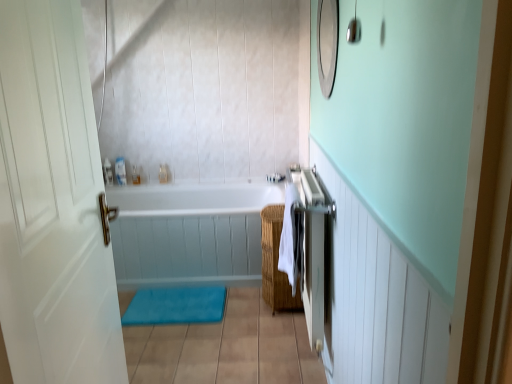
Measure the distance between point (165, 308) and camera.

A: They are 8.16 feet apart.

Where is `translucent plastic container at upper center, the first toiletry when ordered from right to left`? The width and height of the screenshot is (512, 384). translucent plastic container at upper center, the first toiletry when ordered from right to left is located at coordinates (163, 174).

Describe the element at coordinates (189, 231) in the screenshot. I see `white glossy bathtub at center` at that location.

The image size is (512, 384). What do you see at coordinates (108, 171) in the screenshot?
I see `clear plastic bottle at upper left, placed as the third toiletry when sorted from right to left` at bounding box center [108, 171].

Image resolution: width=512 pixels, height=384 pixels. I want to click on woven brown basket at center, so click(275, 263).

Does point (283, 240) come closer to viewer compared to point (0, 46)?

No, it is not.

Does white cotton beach towel at right have a smaller size compared to white matte door at left?

Yes.

Is white cotton beach towel at right wider or thinner than white matte door at left?

white cotton beach towel at right is wider than white matte door at left.

Considering the relative positions of white cotton beach towel at right and white matte door at left in the image provided, is white cotton beach towel at right to the left or to the right of white matte door at left?

In the image, white cotton beach towel at right appears on the right side of white matte door at left.

From a real-world perspective, is clear plastic bottle at upper left, placed as the third toiletry when sorted from right to left, over white matte door at left?

No.

Which point is more forward, [109,172] or [26,294]?

Positioned in front is point [26,294].

Is clear plastic bottle at upper left, positioned as the first toiletry in left-to-right order, far away from white matte door at left?

Yes.

Is white matte door at left positioned before woven brown basket at center?

That is True.

Based on the photo, is white matte door at left taller than woven brown basket at center?

Correct, white matte door at left is much taller as woven brown basket at center.

Is white matte door at left facing towards woven brown basket at center?

No, white matte door at left is not aimed at woven brown basket at center.

Can you confirm if white matte door at left is thinner than woven brown basket at center?

Correct, the width of white matte door at left is less than that of woven brown basket at center.

From a real-world perspective, is translucent plastic soap dispenser at upper center, which ranks as the second toiletry in right-to-left order, on blue fabric bath mat at lower center?

Yes, from a real-world perspective, translucent plastic soap dispenser at upper center, which ranks as the second toiletry in right-to-left order, is above blue fabric bath mat at lower center.

Could you tell me if translucent plastic soap dispenser at upper center, which ranks as the second toiletry in right-to-left order, is facing blue fabric bath mat at lower center?

No.

Can you confirm if translucent plastic soap dispenser at upper center, which ranks as the second toiletry in right-to-left order, is positioned to the right of blue fabric bath mat at lower center?

No, translucent plastic soap dispenser at upper center, which ranks as the second toiletry in right-to-left order, is not to the right of blue fabric bath mat at lower center.

Is translucent plastic soap dispenser at upper center, marked as the 2th toiletry in a left-to-right arrangement, smaller than blue fabric bath mat at lower center?

Yes.

From the image's perspective, is translucent plastic container at upper center, which ranks as the 3th toiletry in left-to-right order, over translucent plastic soap dispenser at upper center, marked as the 2th toiletry in a left-to-right arrangement?

Indeed, from the image's perspective, translucent plastic container at upper center, which ranks as the 3th toiletry in left-to-right order, is shown above translucent plastic soap dispenser at upper center, marked as the 2th toiletry in a left-to-right arrangement.

Would you say translucent plastic container at upper center, the first toiletry when ordered from right to left, contains translucent plastic soap dispenser at upper center, marked as the 2th toiletry in a left-to-right arrangement?

No.

Is the depth of translucent plastic container at upper center, which ranks as the 3th toiletry in left-to-right order, less than that of translucent plastic soap dispenser at upper center, marked as the 2th toiletry in a left-to-right arrangement?

No, it is not.

Is translucent plastic container at upper center, which ranks as the 3th toiletry in left-to-right order, wider than translucent plastic soap dispenser at upper center, marked as the 2th toiletry in a left-to-right arrangement?

No, translucent plastic container at upper center, which ranks as the 3th toiletry in left-to-right order, is not wider than translucent plastic soap dispenser at upper center, marked as the 2th toiletry in a left-to-right arrangement.

Is point (229, 240) positioned behind point (281, 291)?

Yes, it is.

Is white glossy bathtub at center at the right side of woven brown basket at center?

No, white glossy bathtub at center is not to the right of woven brown basket at center.

From the image's perspective, is white glossy bathtub at center located above or below woven brown basket at center?

white glossy bathtub at center is above woven brown basket at center.

Who is taller, white glossy bathtub at center or woven brown basket at center?

woven brown basket at center.

From the image's perspective, between translucent plastic soap dispenser at upper center, which ranks as the second toiletry in right-to-left order, and woven brown basket at center, who is located below?

woven brown basket at center.

Between translucent plastic soap dispenser at upper center, which ranks as the second toiletry in right-to-left order, and woven brown basket at center, which one has smaller size?

With smaller size is translucent plastic soap dispenser at upper center, which ranks as the second toiletry in right-to-left order.

Which of these two, translucent plastic soap dispenser at upper center, marked as the 2th toiletry in a left-to-right arrangement, or woven brown basket at center, is thinner?

With smaller width is translucent plastic soap dispenser at upper center, marked as the 2th toiletry in a left-to-right arrangement.

Considering the relative positions of translucent plastic soap dispenser at upper center, marked as the 2th toiletry in a left-to-right arrangement, and woven brown basket at center in the image provided, is translucent plastic soap dispenser at upper center, marked as the 2th toiletry in a left-to-right arrangement, to the left or to the right of woven brown basket at center?

Clearly, translucent plastic soap dispenser at upper center, marked as the 2th toiletry in a left-to-right arrangement, is on the left of woven brown basket at center in the image.

You are a GUI agent. You are given a task and a screenshot of the screen. Output one action in this format:
    pyautogui.click(x=<x>, y=<y>)
    Task: Click on the door above the white cotton beach towel at right (from a real-world perspective)
    This screenshot has height=384, width=512.
    Given the screenshot: What is the action you would take?
    pyautogui.click(x=53, y=204)

The image size is (512, 384). What are the coordinates of `the 3rd toiletry above when counting from the white matte door at left (from the image's perspective)` in the screenshot? It's located at (108, 171).

When comparing their distances from blue fabric bath mat at lower center, does woven brown basket at center or clear plastic bottle at upper left, placed as the third toiletry when sorted from right to left, seem closer?

woven brown basket at center.

From the image, which object appears to be farther from white cotton beach towel at right, translucent plastic soap dispenser at upper center, which ranks as the second toiletry in right-to-left order, or translucent plastic container at upper center, which ranks as the 3th toiletry in left-to-right order?

Based on the image, translucent plastic soap dispenser at upper center, which ranks as the second toiletry in right-to-left order, appears to be further to white cotton beach towel at right.

Looking at the image, which one is located further to blue fabric bath mat at lower center, translucent plastic container at upper center, the first toiletry when ordered from right to left, or white glossy bathtub at center?

translucent plastic container at upper center, the first toiletry when ordered from right to left, is positioned further to the anchor blue fabric bath mat at lower center.

Considering their positions, is blue fabric bath mat at lower center positioned further to woven brown basket at center than white matte door at left?

white matte door at left is further to woven brown basket at center.

Based on their spatial positions, is white glossy bathtub at center or blue fabric bath mat at lower center further from woven brown basket at center?

Based on the image, blue fabric bath mat at lower center appears to be further to woven brown basket at center.

Which object lies further to the anchor point translucent plastic soap dispenser at upper center, which ranks as the second toiletry in right-to-left order, white matte door at left or translucent plastic container at upper center, which ranks as the 3th toiletry in left-to-right order?

A: white matte door at left is positioned further to the anchor translucent plastic soap dispenser at upper center, which ranks as the second toiletry in right-to-left order.

From the picture: Which object lies nearer to the anchor point clear plastic bottle at upper left, positioned as the first toiletry in left-to-right order, blue fabric bath mat at lower center or translucent plastic container at upper center, the first toiletry when ordered from right to left?

Based on the image, translucent plastic container at upper center, the first toiletry when ordered from right to left, appears to be nearer to clear plastic bottle at upper left, positioned as the first toiletry in left-to-right order.

Based on their spatial positions, is translucent plastic container at upper center, the first toiletry when ordered from right to left, or woven brown basket at center closer to white glossy bathtub at center?

woven brown basket at center is positioned closer to the anchor white glossy bathtub at center.

Where is `bathtub located between blue fabric bath mat at lower center and translucent plastic soap dispenser at upper center, marked as the 2th toiletry in a left-to-right arrangement, in the depth direction`? Image resolution: width=512 pixels, height=384 pixels. bathtub located between blue fabric bath mat at lower center and translucent plastic soap dispenser at upper center, marked as the 2th toiletry in a left-to-right arrangement, in the depth direction is located at coordinates (189, 231).

This screenshot has width=512, height=384. What are the coordinates of `basket between white matte door at left and translucent plastic container at upper center, which ranks as the 3th toiletry in left-to-right order, in the front-back direction` in the screenshot? It's located at (275, 263).

The width and height of the screenshot is (512, 384). What are the coordinates of `bathtub between white cotton beach towel at right and translucent plastic soap dispenser at upper center, marked as the 2th toiletry in a left-to-right arrangement, in the front-back direction` in the screenshot? It's located at (189, 231).

Locate an element on the screen. toiletry between blue fabric bath mat at lower center and translucent plastic soap dispenser at upper center, marked as the 2th toiletry in a left-to-right arrangement, in the front-back direction is located at coordinates (108, 171).